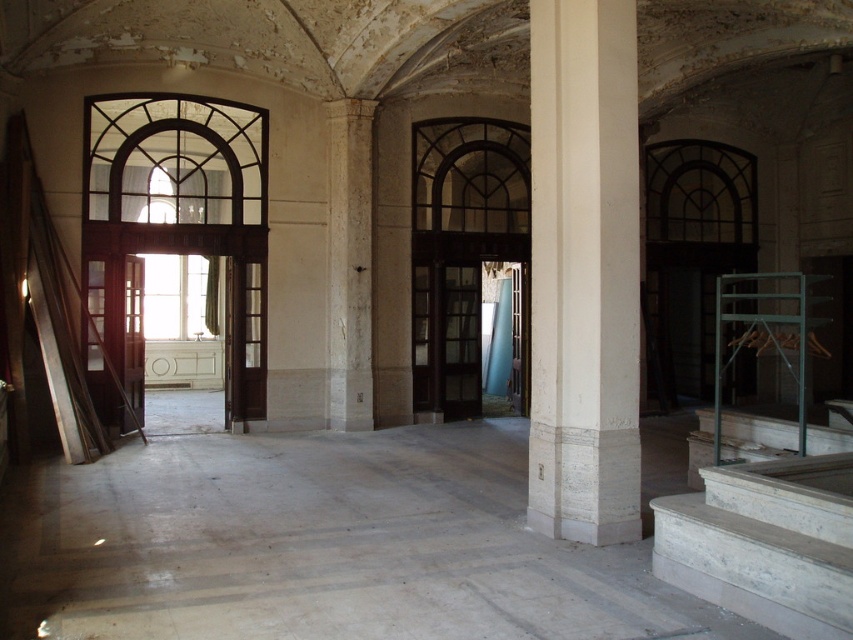
Who is shorter, white marble column at center or white marble stairs at lower right?

With less height is white marble stairs at lower right.

Does white marble column at center have a lesser width compared to white marble stairs at lower right?

Yes.

Between point (538, 168) and point (805, 547), which one is positioned in front?

Point (805, 547)

Identify the location of white marble column at center. (584, 272).